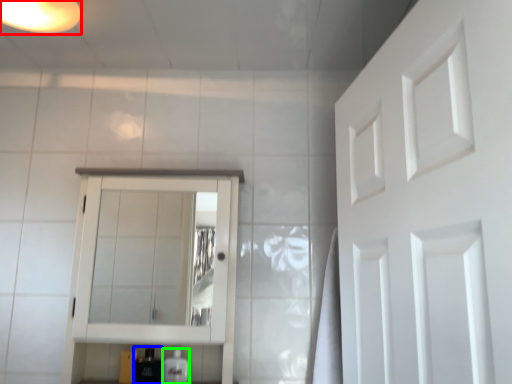
Question: Estimate the real-world distances between objects in this image. Which object is closer to light fixture (highlighted by a red box), toiletry (highlighted by a blue box) or toiletry (highlighted by a green box)?

Choices:
 (A) toiletry
 (B) toiletry

Answer: (A)